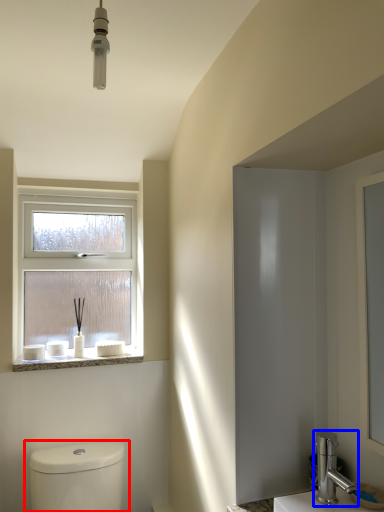
Question: Which of the following is the farthest to the observer, toilet (highlighted by a red box) or tap (highlighted by a blue box)?

Choices:
 (A) toilet
 (B) tap

Answer: (A)